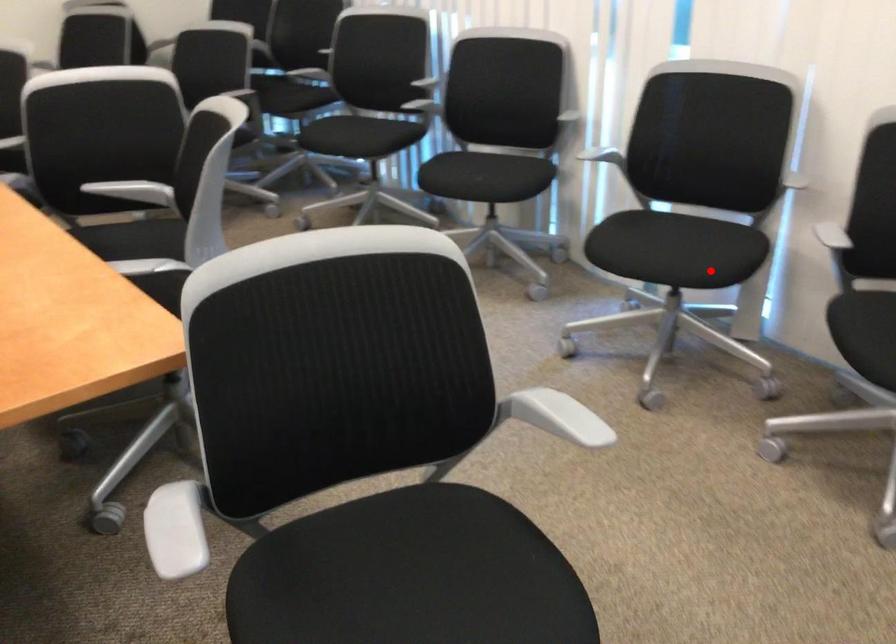
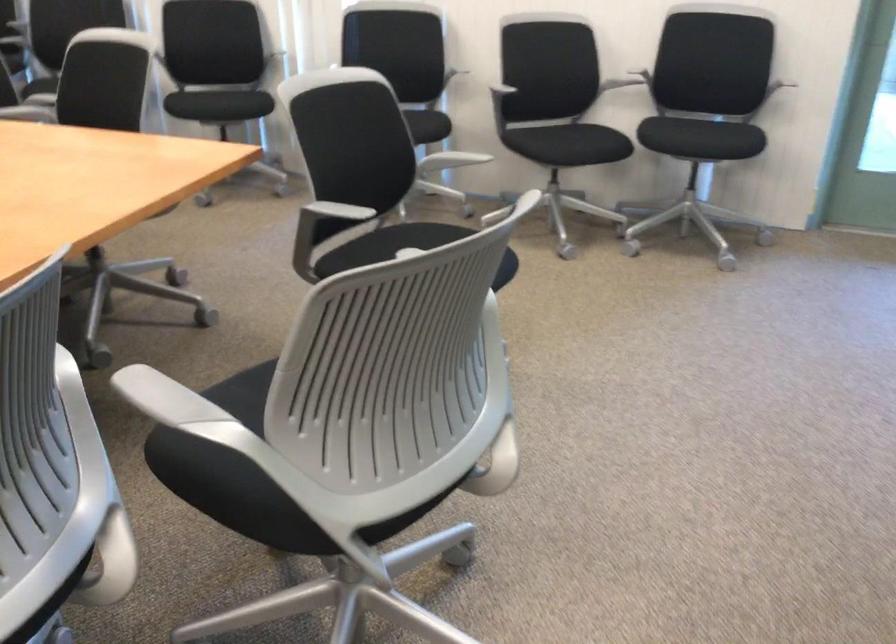
Question: I am providing you with two images of the same scene from different viewpoints. Given a red point in image1, look at the same physical point in image2. Is it:

Choices:
 (A) Closer to the viewpoint
 (B) Farther from the viewpoint

Answer: (B)